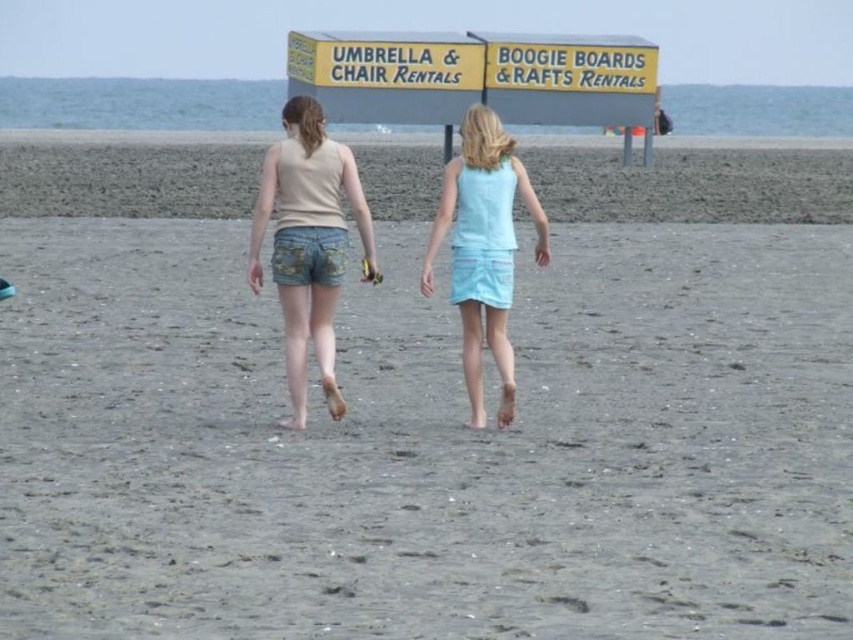
Who is higher up, gray sand at center or light blue fabric skirt at center?

Positioned higher is light blue fabric skirt at center.

Between point (822, 572) and point (489, 166), which one is positioned in front?

Point (822, 572) is more forward.

Find the location of a particular element. Image resolution: width=853 pixels, height=640 pixels. gray sand at center is located at coordinates (427, 444).

Can you confirm if light blue denim shorts at center is wider than light blue fabric skirt at center?

Yes.

Between light blue denim shorts at center and light blue fabric skirt at center, which one appears on the left side from the viewer's perspective?

Positioned to the left is light blue denim shorts at center.

You are a GUI agent. You are given a task and a screenshot of the screen. Output one action in this format:
    pyautogui.click(x=<x>, y=<y>)
    Task: Click on the light blue denim shorts at center
    The height and width of the screenshot is (640, 853).
    Given the screenshot: What is the action you would take?
    pyautogui.click(x=693, y=184)

Locate an element on the screen. light blue denim shorts at center is located at coordinates (693, 184).

Can you confirm if denim shorts at center is shorter than light blue fabric skirt at center?

No.

At what (x,y) coordinates should I click in order to perform the action: click on denim shorts at center. Please return your answer as a coordinate pair (x, y). The height and width of the screenshot is (640, 853). Looking at the image, I should click on (308, 243).

Which is behind, point (289, 195) or point (503, 404)?

Point (289, 195)

Locate an element on the screen. Image resolution: width=853 pixels, height=640 pixels. denim shorts at center is located at coordinates (308, 243).